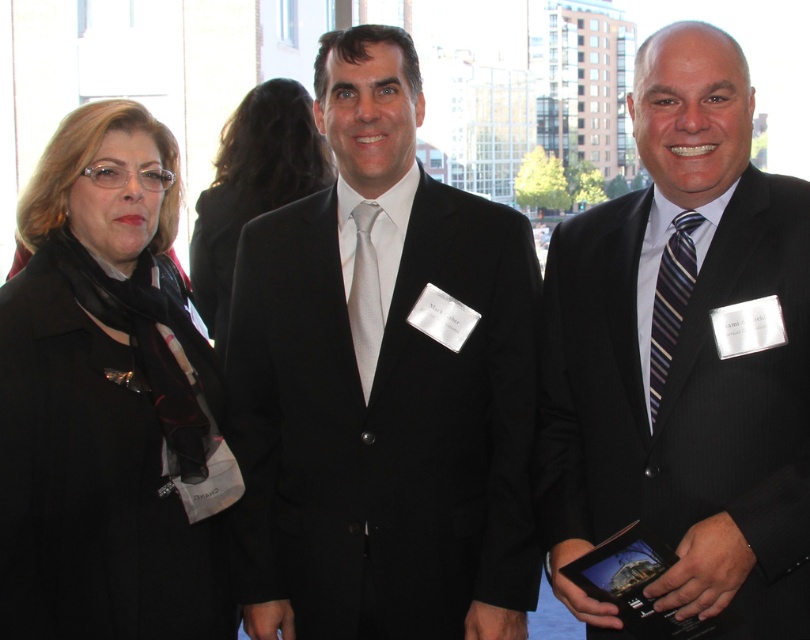
Where is the black matte suit at center located in the image?

The black matte suit at center is located at point 0.606 on the x axis and 0.473 on the y axis.

You are a photographer adjusting your camera focus. You need to focus on the black matte suit at center and the white silk tie at center. Which one should you adjust your focus to first to ensure both are in sharp focus?

The black matte suit at center is closer to the viewer than the white silk tie at center, so you should focus on the black matte suit at center first. This ensures that when adjusting focus, both objects will remain in sharp focus as the depth of field captures both the closer and farther objects.

You are standing in a professional event and see three people. The left person is wearing a black coat. A point at coordinate (x=109, y=401) marks the location of the black wool coat at left. If you want to approach the person in the center, which direction should you move relative to this point?

To approach the person in the center from the point marking the black wool coat at left, you should move to the right.